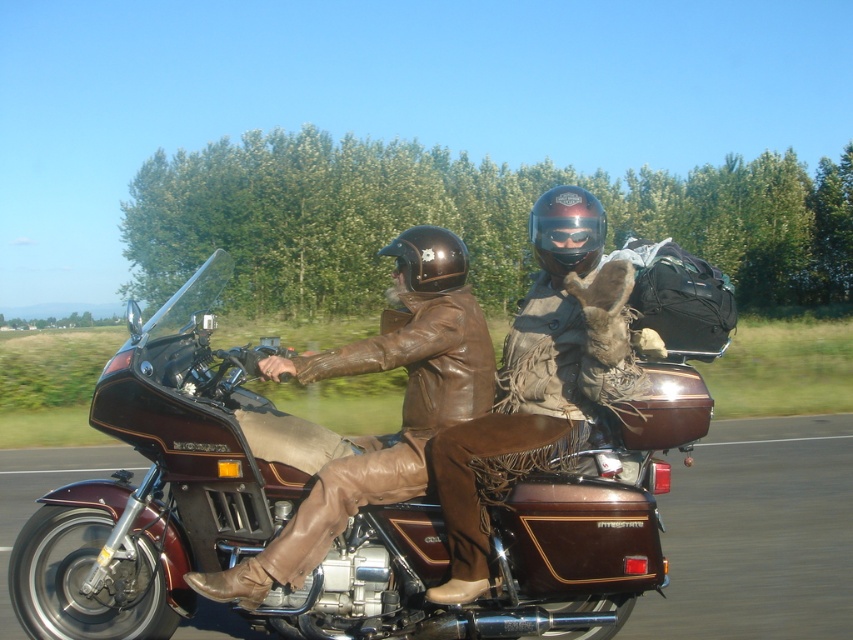
Question: Which point is closer to the camera taking this photo?

Choices:
 (A) (407, 538)
 (B) (555, 253)
 (C) (456, 390)
 (D) (444, 260)

Answer: (A)

Question: From the image, what is the correct spatial relationship of brown leather jacket at center in relation to black matte helmet at center?

Choices:
 (A) right
 (B) left

Answer: (B)

Question: Is brown leather motorcycle at center wider than black matte helmet at center?

Choices:
 (A) no
 (B) yes

Answer: (B)

Question: Among these points, which one is farthest from the camera?

Choices:
 (A) (601, 221)
 (B) (546, 212)
 (C) (427, 230)
 (D) (393, 534)

Answer: (C)

Question: Which of the following is the closest to the observer?

Choices:
 (A) (596, 362)
 (B) (277, 493)
 (C) (263, 560)
 (D) (398, 236)

Answer: (C)

Question: Does shiny black helmet at center come behind black matte helmet at center?

Choices:
 (A) yes
 (B) no

Answer: (B)